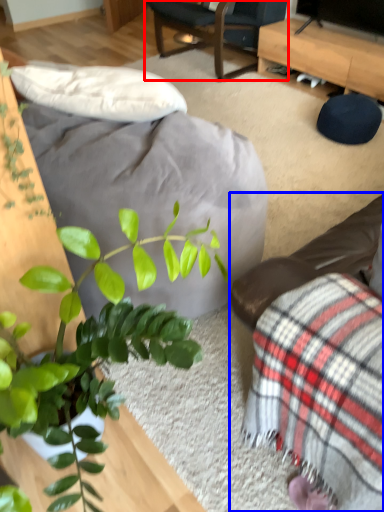
Question: Which point is further to the camera, chair (highlighted by a red box) or studio couch (highlighted by a blue box)?

Choices:
 (A) chair
 (B) studio couch

Answer: (A)